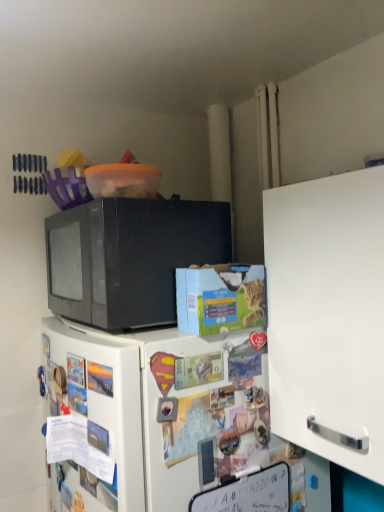
Question: Is black matte microwave at upper left positioned beyond the bounds of white matte cabinet at right?

Choices:
 (A) yes
 (B) no

Answer: (A)

Question: Is black matte microwave at upper left not close to white matte cabinet at right?

Choices:
 (A) no
 (B) yes

Answer: (A)

Question: From a real-world perspective, is black matte microwave at upper left on top of white matte cabinet at right?

Choices:
 (A) no
 (B) yes

Answer: (B)

Question: Is black matte microwave at upper left in contact with white matte cabinet at right?

Choices:
 (A) no
 (B) yes

Answer: (A)

Question: From the image's perspective, is black matte microwave at upper left over white matte cabinet at right?

Choices:
 (A) yes
 (B) no

Answer: (A)

Question: Does black matte microwave at upper left come in front of white matte cabinet at right?

Choices:
 (A) no
 (B) yes

Answer: (A)

Question: From a real-world perspective, is black matte microwave at upper left physically above white matte refrigerator at center?

Choices:
 (A) yes
 (B) no

Answer: (A)

Question: Can you confirm if black matte microwave at upper left is wider than white matte refrigerator at center?

Choices:
 (A) yes
 (B) no

Answer: (B)

Question: From the image's perspective, does black matte microwave at upper left appear lower than white matte refrigerator at center?

Choices:
 (A) no
 (B) yes

Answer: (A)

Question: Does black matte microwave at upper left appear on the left side of white matte refrigerator at center?

Choices:
 (A) no
 (B) yes

Answer: (B)

Question: Are black matte microwave at upper left and white matte refrigerator at center far apart?

Choices:
 (A) yes
 (B) no

Answer: (B)

Question: Can we say black matte microwave at upper left lies outside white matte refrigerator at center?

Choices:
 (A) no
 (B) yes

Answer: (B)

Question: Does white matte refrigerator at center have a lesser width compared to black matte microwave at upper left?

Choices:
 (A) yes
 (B) no

Answer: (B)